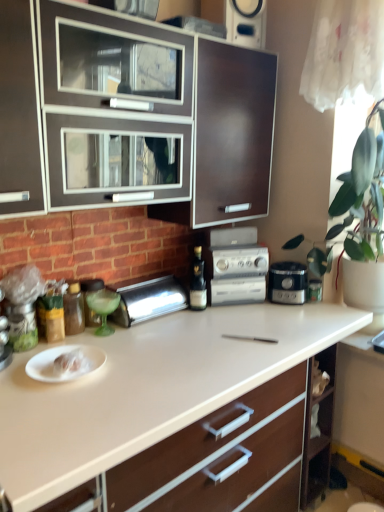
Image resolution: width=384 pixels, height=512 pixels. I want to click on vacant space in front of satin black coffee maker at center, so click(302, 316).